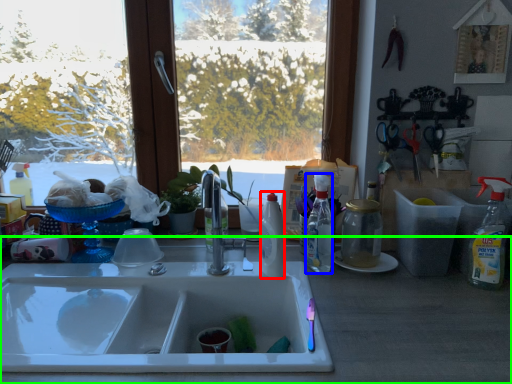
Question: Considering the real-world distances, which object is farthest from bottle (highlighted by a red box)? bottle (highlighted by a blue box) or counter top (highlighted by a green box)?

Choices:
 (A) bottle
 (B) counter top

Answer: (B)